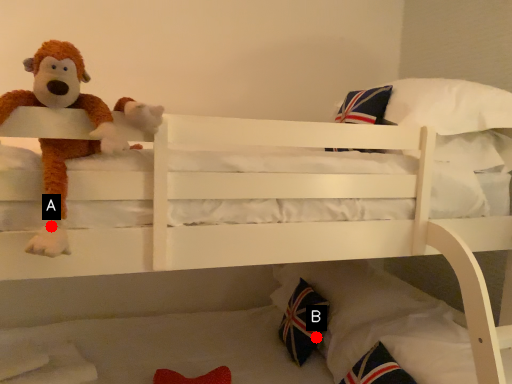
Question: Two points are circled on the image, labeled by A and B beside each circle. Which of the following is the closest to the observer?

Choices:
 (A) A is closer
 (B) B is closer

Answer: (A)